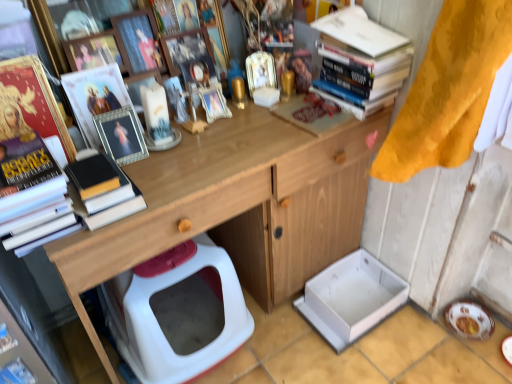
Find the location of a particular element. The width and height of the screenshot is (512, 384). metallic silver picture frame at upper left, placed as the first picture frame when sorted from bottom to top is located at coordinates (121, 135).

The width and height of the screenshot is (512, 384). What do you see at coordinates (95, 97) in the screenshot? I see `metallic silver photo frame at upper center` at bounding box center [95, 97].

Identify the location of wooden picture frame at center, the 4th picture frame when ordered from bottom to top. The image size is (512, 384). (186, 48).

Is blue paper magazine at lower left situated inside wooden picture frame at upper center, which is the 2th picture frame in top-to-bottom order, or outside?

blue paper magazine at lower left is spatially situated outside wooden picture frame at upper center, which is the 2th picture frame in top-to-bottom order.

Based on the photo, can you confirm if blue paper magazine at lower left is bigger than wooden picture frame at upper center, the 3th picture frame from the bottom?

No, blue paper magazine at lower left is not bigger than wooden picture frame at upper center, the 3th picture frame from the bottom.

Which is behind, point (15, 373) or point (152, 58)?

Positioned behind is point (152, 58).

From the image's perspective, is wooden picture frame at upper center, the 3th picture frame from the bottom, located beneath metallic silver picture frame at upper center, the second picture frame ordered from the bottom?

No, from the image's perspective, wooden picture frame at upper center, the 3th picture frame from the bottom, is not below metallic silver picture frame at upper center, the second picture frame ordered from the bottom.

Is wooden picture frame at upper center, the 3th picture frame from the bottom, inside or outside of metallic silver picture frame at upper center, which is the 3th picture frame in top-to-bottom order?

wooden picture frame at upper center, the 3th picture frame from the bottom, is located beyond the bounds of metallic silver picture frame at upper center, which is the 3th picture frame in top-to-bottom order.

From a real-world perspective, is wooden picture frame at upper center, which is the 2th picture frame in top-to-bottom order, over metallic silver picture frame at upper center, which is the 3th picture frame in top-to-bottom order?

Indeed, from a real-world perspective, wooden picture frame at upper center, which is the 2th picture frame in top-to-bottom order, stands above metallic silver picture frame at upper center, which is the 3th picture frame in top-to-bottom order.

Can you confirm if wooden picture frame at upper center, the 3th picture frame from the bottom, is shorter than metallic silver picture frame at upper center, the second picture frame ordered from the bottom?

Incorrect, the height of wooden picture frame at upper center, the 3th picture frame from the bottom, does not fall short of that of metallic silver picture frame at upper center, the second picture frame ordered from the bottom.

Considering the relative sizes of matte plastic toy at upper center and metallic silver photo frame at upper center in the image provided, is matte plastic toy at upper center taller than metallic silver photo frame at upper center?

In fact, matte plastic toy at upper center may be shorter than metallic silver photo frame at upper center.

Which is more to the right, matte plastic toy at upper center or metallic silver photo frame at upper center?

matte plastic toy at upper center is more to the right.

Is matte plastic toy at upper center positioned in front of metallic silver photo frame at upper center?

No.

Would you say matte plastic toy at upper center is a long distance from metallic silver photo frame at upper center?

No, matte plastic toy at upper center is in close proximity to metallic silver photo frame at upper center.

Is wooden at upper center oriented away from wooden picture frame at center, which is counted as the first picture frame, starting from the top?

That's not correct — wooden at upper center is not looking away from wooden picture frame at center, which is counted as the first picture frame, starting from the top.

From the image's perspective, between wooden at upper center and wooden picture frame at center, the 4th picture frame when ordered from bottom to top, which one is located above?

wooden picture frame at center, the 4th picture frame when ordered from bottom to top.

Is wooden at upper center placed right next to wooden picture frame at center, which is counted as the first picture frame, starting from the top?

wooden at upper center and wooden picture frame at center, which is counted as the first picture frame, starting from the top, are not in contact.

Considering the points (303, 279) and (143, 56), which point is in front, point (303, 279) or point (143, 56)?

The point (143, 56) is closer.

Between wooden at upper center and wooden picture frame at upper center, the 3th picture frame from the bottom, which one appears on the right side from the viewer's perspective?

→ From the viewer's perspective, wooden at upper center appears more on the right side.

Is wooden at upper center not close to wooden picture frame at upper center, which is the 2th picture frame in top-to-bottom order?

No, wooden at upper center is not far away from wooden picture frame at upper center, which is the 2th picture frame in top-to-bottom order.

The image size is (512, 384). Identify the location of picture frame that is the 2nd object located behind the metallic silver photo frame at upper center. (139, 41).

From a real-world perspective, which object stands above the other?

wooden picture frame at upper center, which is the 2th picture frame in top-to-bottom order, from a real-world perspective.

Considering the relative positions of metallic silver photo frame at upper center and wooden picture frame at upper center, which is the 2th picture frame in top-to-bottom order, in the image provided, is metallic silver photo frame at upper center to the left of wooden picture frame at upper center, which is the 2th picture frame in top-to-bottom order, from the viewer's perspective?

Yes.

I want to click on picture frame on the right side of wooden picture frame at upper center, which is the 2th picture frame in top-to-bottom order, so click(x=186, y=48).

From a real-world perspective, who is located higher, wooden picture frame at upper center, which is the 2th picture frame in top-to-bottom order, or wooden picture frame at center, which is counted as the first picture frame, starting from the top?

wooden picture frame at upper center, which is the 2th picture frame in top-to-bottom order.

Which object is more forward, wooden picture frame at upper center, which is the 2th picture frame in top-to-bottom order, or wooden picture frame at center, the 4th picture frame when ordered from bottom to top?

wooden picture frame at upper center, which is the 2th picture frame in top-to-bottom order, is closer to the camera.

Where is `the 3rd picture frame to the right of the blue paper magazine at lower left, starting your count from the anchor`? the 3rd picture frame to the right of the blue paper magazine at lower left, starting your count from the anchor is located at coordinates (139, 41).

At what (x,y) coordinates should I click in order to perform the action: click on picture frame that is the 1st one when counting downward from the wooden picture frame at upper center, which is the 2th picture frame in top-to-bottom order (from the image's perspective). Please return your answer as a coordinate pair (x, y). This screenshot has height=384, width=512. Looking at the image, I should click on (96, 51).

Which object lies further to the anchor point metallic silver picture frame at upper left, placed as the first picture frame when sorted from bottom to top, matte gold book at upper left, the first book in the left-to-right sequence, or blue paper magazine at lower left?

Among the two, blue paper magazine at lower left is located further to metallic silver picture frame at upper left, placed as the first picture frame when sorted from bottom to top.

From the image, which object appears to be farther from wooden picture frame at center, the 4th picture frame when ordered from bottom to top, hardcover books at upper right, marked as the second book in a left-to-right arrangement, or matte gold book at upper left, placed as the 2th book when sorted from right to left?

hardcover books at upper right, marked as the second book in a left-to-right arrangement, is further to wooden picture frame at center, the 4th picture frame when ordered from bottom to top.

Looking at the image, which one is located further to white glossy plate at lower right, white cardboard box at lower center or metallic silver photo frame at upper center?

The object further to white glossy plate at lower right is metallic silver photo frame at upper center.

From the image, which object appears to be nearer to wooden picture frame at center, which is counted as the first picture frame, starting from the top, white plastic toilet at lower center or metallic silver picture frame at upper left, which appears as the 4th picture frame when viewed from the top?

metallic silver picture frame at upper left, which appears as the 4th picture frame when viewed from the top, is closer to wooden picture frame at center, which is counted as the first picture frame, starting from the top.

Consider the image. Which object lies nearer to the anchor point white cardboard box at lower center, white plastic toilet at lower center or blue paper magazine at lower left?

The object closer to white cardboard box at lower center is white plastic toilet at lower center.

Considering their positions, is metallic silver photo frame at upper center positioned further to matte plastic toy at upper center than metallic silver picture frame at upper center, the second picture frame ordered from the bottom?

Based on the image, metallic silver photo frame at upper center appears to be further to matte plastic toy at upper center.

Considering their positions, is gold metallic bottle at center positioned further to white plastic toilet at lower center than blue paper magazine at lower left?

gold metallic bottle at center lies further to white plastic toilet at lower center than the other object.

Based on their spatial positions, is matte gold book at upper left, placed as the 2th book when sorted from right to left, or wooden at upper center further from blue paper magazine at lower left?

wooden at upper center lies further to blue paper magazine at lower left than the other object.

You are a GUI agent. You are given a task and a screenshot of the screen. Output one action in this format:
    pyautogui.click(x=<x>, y=<y>)
    Task: Click on the toilet paper located between blue paper magazine at lower left and white glossy plate at lower right in the left-right direction
    Image resolution: width=512 pixels, height=384 pixels.
    Given the screenshot: What is the action you would take?
    pyautogui.click(x=351, y=298)

Where is `bottle between metallic silver picture frame at upper left, placed as the first picture frame when sorted from bottom to top, and white glossy plate at lower right from left to right`? The height and width of the screenshot is (384, 512). bottle between metallic silver picture frame at upper left, placed as the first picture frame when sorted from bottom to top, and white glossy plate at lower right from left to right is located at coordinates (237, 84).

This screenshot has width=512, height=384. In order to click on toilet situated between matte gold book at upper left, placed as the 2th book when sorted from right to left, and white glossy plate at lower right from left to right in this screenshot , I will do `click(177, 314)`.

Find the location of a particular element. bottle between blue paper magazine at lower left and white glossy plate at lower right in the horizontal direction is located at coordinates (237, 84).